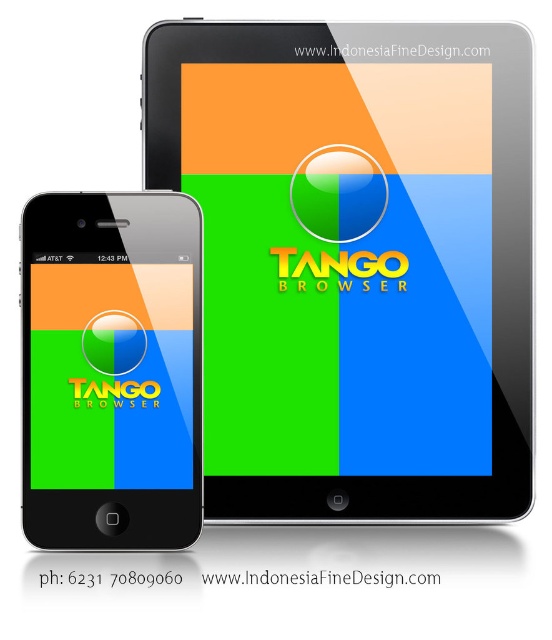
You are positioning a matte black smartphone at left on a table. If the table is represented by a coordinate system where the bottom left corner is the origin, what are the coordinates of the smartphone?

The coordinates of the matte black smartphone at left are at point (x=112, y=371).

You are looking at the smartphone and tablet both showing the Tango Browser. The smartphone has a black body with a silver frame and its screen shows a colorful background divided into four quadrants. The tablet is behind and to the right of the smartphone. There is a point marked at coordinates (355, 264). Which device does this point correspond to?

The point (355, 264) indicates the matte black tablet at center.